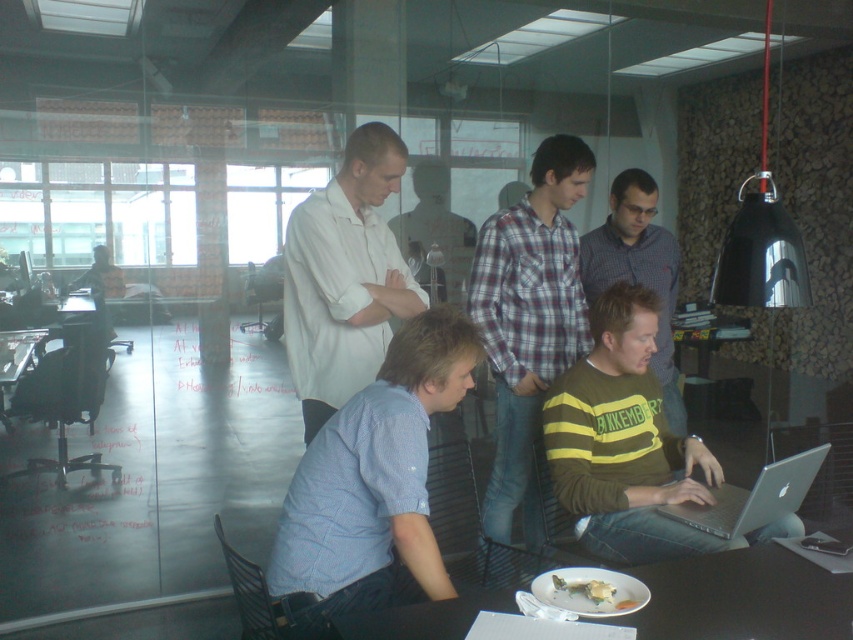
Question: Among these points, which one is farthest from the camera?

Choices:
 (A) (3, 376)
 (B) (361, 618)
 (C) (596, 509)

Answer: (A)

Question: Where is plaid cotton shirt at center located in relation to white matte shirt at center in the image?

Choices:
 (A) left
 (B) right

Answer: (B)

Question: Is black glossy table at lower center closer to the viewer compared to green striped shirt at center?

Choices:
 (A) yes
 (B) no

Answer: (A)

Question: Among these objects, which one is farthest from the camera?

Choices:
 (A) black glossy table at lower center
 (B) green striped shirt at center
 (C) white paper plate at lower center
 (D) white matte shirt at center

Answer: (B)

Question: Is plaid cotton shirt at center bigger than black glossy table at lower center?

Choices:
 (A) yes
 (B) no

Answer: (A)

Question: Which object appears farthest from the camera in this image?

Choices:
 (A) green striped sweater at center
 (B) blue checkered shirt at center

Answer: (A)